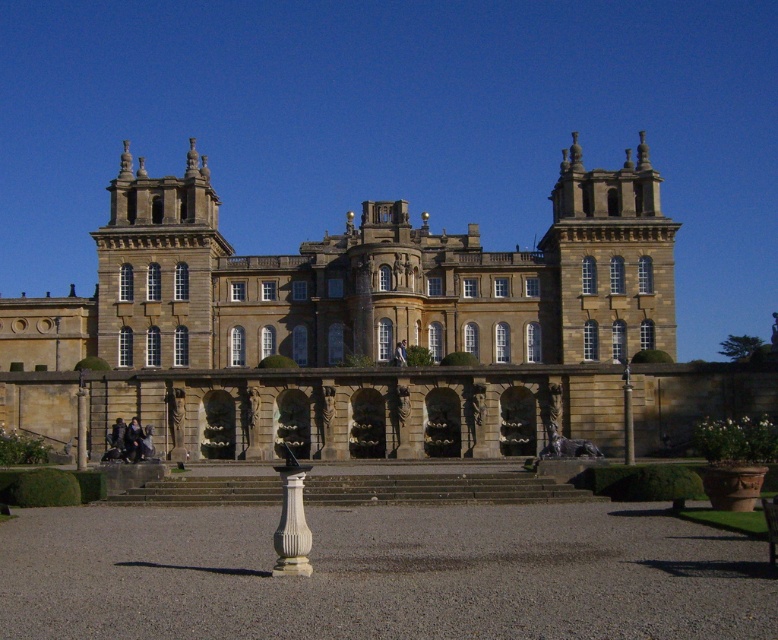
Who is higher up, brown stone palace at center or white marble column at center?

brown stone palace at center is higher up.

Does brown stone palace at center come in front of white marble column at center?

No, brown stone palace at center is further to the viewer.

Is point (652, 168) positioned after point (303, 557)?

Yes, point (652, 168) is farther from viewer.

I want to click on brown stone palace at center, so click(361, 284).